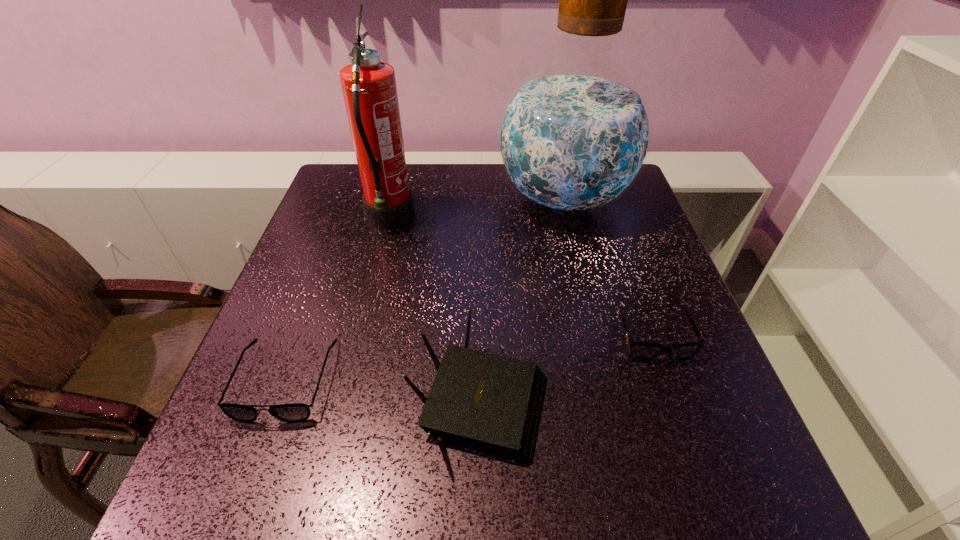
The image size is (960, 540). Identify the location of water jug that is at the far edge. (574, 136).

Image resolution: width=960 pixels, height=540 pixels. In order to click on fire extinguisher positioned at the far edge in this screenshot , I will do `click(369, 89)`.

At what (x,y) coordinates should I click in order to perform the action: click on object situated at the near edge. Please return your answer as a coordinate pair (x, y). This screenshot has width=960, height=540. Looking at the image, I should click on (489, 403).

This screenshot has height=540, width=960. I want to click on fire extinguisher at the left edge, so click(369, 89).

In order to click on spectacles at the left edge in this screenshot , I will do `click(295, 412)`.

I want to click on water jug that is at the right edge, so click(574, 136).

Find the location of `sunglasses present at the right edge`. sunglasses present at the right edge is located at coordinates (641, 351).

Identify the location of object positioned at the far left corner. (369, 89).

What are the coordinates of `object that is at the far right corner` in the screenshot? It's located at (574, 136).

At what (x,y) coordinates should I click in order to perform the action: click on vacant space at the far edge of the desktop. Please return your answer as a coordinate pair (x, y). The width and height of the screenshot is (960, 540). Looking at the image, I should click on (509, 202).